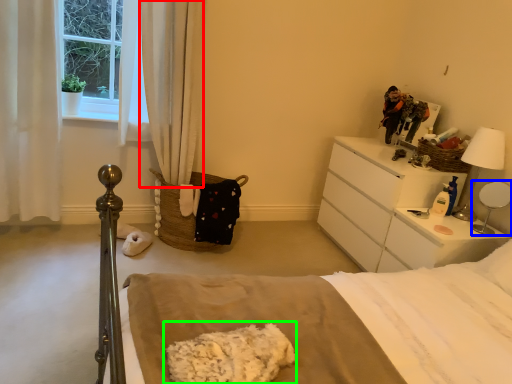
Question: Which object is the closest to the curtain (highlighted by a red box)? Choose among these: table lamp (highlighted by a blue box) or material (highlighted by a green box).

Choices:
 (A) table lamp
 (B) material

Answer: (B)